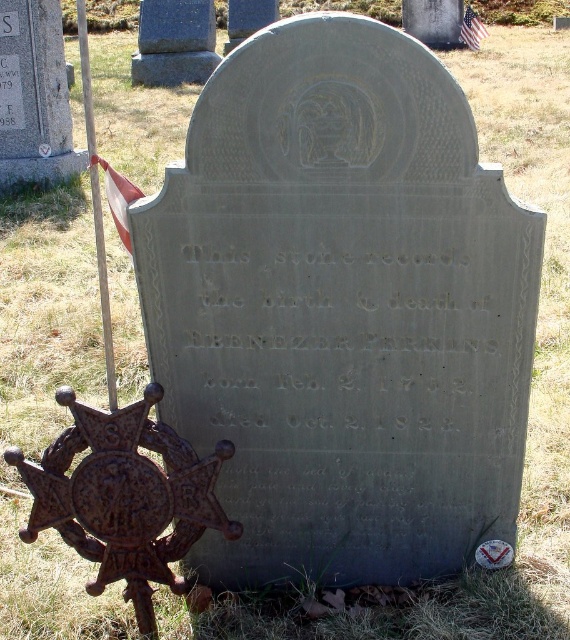
You are a groundskeeper at the cemetery. You need to replace the american flag at upper center and the wooden pole at left. Which object has a greater width?

The wooden pole at left has a greater width than the american flag at upper center.

You are a visitor at a cemetery and see the smooth gray stone at center and the american flag at upper center. Which object is closer to you?

The smooth gray stone at center is closer to you because it is in front of the american flag at upper center.